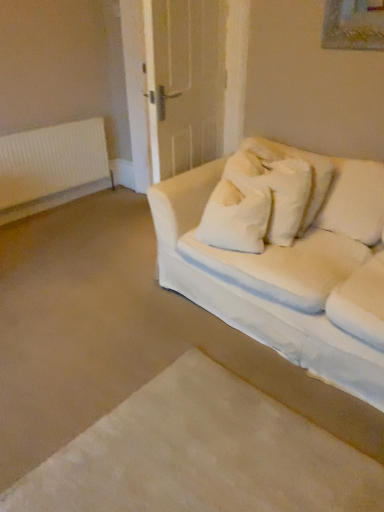
Find the location of a particular element. This screenshot has width=384, height=512. free point in front of white plastic radiator at left is located at coordinates (67, 231).